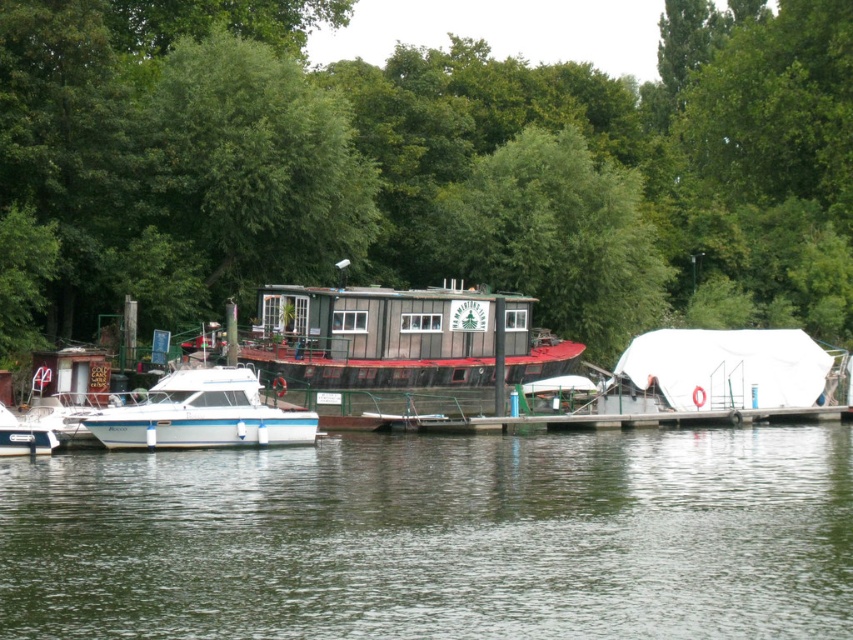
Can you confirm if white tarpaulin tent at right is wider than white glossy boat at left?

Correct, the width of white tarpaulin tent at right exceeds that of white glossy boat at left.

Is point (676, 330) positioned before point (152, 392)?

No, it is behind (152, 392).

Is point (811, 392) behind point (248, 403)?

Yes.

You are a GUI agent. You are given a task and a screenshot of the screen. Output one action in this format:
    pyautogui.click(x=<x>, y=<y>)
    Task: Click on the white tarpaulin tent at right
    The height and width of the screenshot is (640, 853).
    Given the screenshot: What is the action you would take?
    pyautogui.click(x=720, y=371)

Who is positioned more to the right, green leafy tree at upper center or white glossy boat at lower left?

From the viewer's perspective, green leafy tree at upper center appears more on the right side.

This screenshot has height=640, width=853. I want to click on green leafy tree at upper center, so click(x=422, y=168).

Is point (508, 305) more distant than point (791, 353)?

No, (508, 305) is in front of (791, 353).

Does wooden cabin boat at center come in front of white tarpaulin tent at right?

Yes, it is in front of white tarpaulin tent at right.

The width and height of the screenshot is (853, 640). I want to click on wooden cabin boat at center, so click(x=399, y=337).